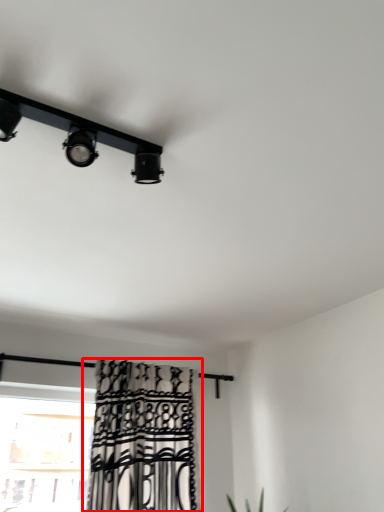
Question: From the image's perspective, where is curtain (annotated by the red box) located relative to lamp?

Choices:
 (A) below
 (B) above

Answer: (A)